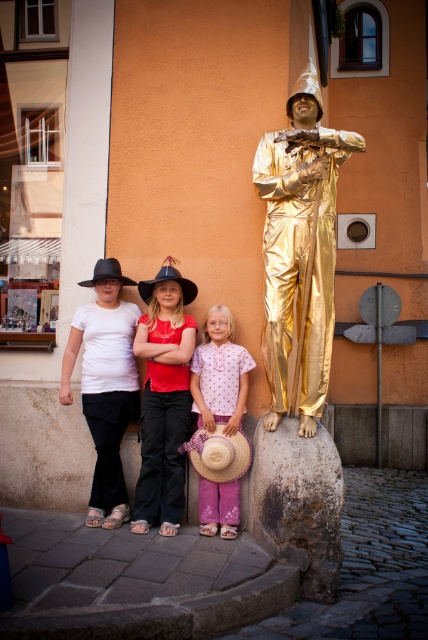
Which is below, strawtexturehat at lower center or black felt cowboy hat at center?

strawtexturehat at lower center is lower down.

Does strawtexturehat at lower center have a larger size compared to black felt cowboy hat at center?

No.

Between point (208, 452) and point (145, 298), which one is positioned behind?

The point (145, 298) is more distant.

Locate an element on the screen. The height and width of the screenshot is (640, 428). strawtexturehat at lower center is located at coordinates (219, 452).

Is gold shiny statue at center to the left of black felt cowboy hat at center from the viewer's perspective?

Incorrect, gold shiny statue at center is not on the left side of black felt cowboy hat at center.

Does point (297, 269) come in front of point (146, 280)?

Yes, point (297, 269) is in front of point (146, 280).

Image resolution: width=428 pixels, height=640 pixels. In order to click on gold shiny statue at center in this screenshot , I will do `click(300, 244)`.

Based on the photo, is gold shiny statue at center to the left of pink fabric dress at center from the viewer's perspective?

Incorrect, gold shiny statue at center is not on the left side of pink fabric dress at center.

Who is lower down, gold shiny statue at center or pink fabric dress at center?

pink fabric dress at center

Does point (308, 376) come behind point (198, 426)?

No, it is not.

This screenshot has height=640, width=428. In order to click on gold shiny statue at center in this screenshot , I will do `click(300, 244)`.